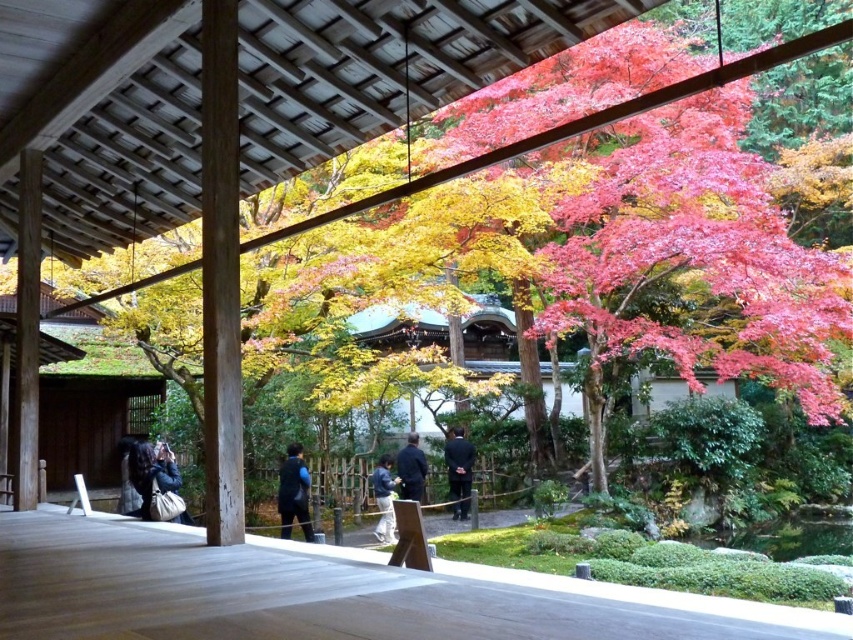
Is black matte vest at center above dark blue fabric at center?

No.

Which is in front, point (289, 456) or point (445, 461)?

Point (289, 456) is in front.

Find the location of a particular element. black matte vest at center is located at coordinates (294, 492).

Is dark blue fabric bag at lower left further to the viewer compared to black matte vest at center?

That is False.

This screenshot has width=853, height=640. What do you see at coordinates (155, 483) in the screenshot?
I see `dark blue fabric bag at lower left` at bounding box center [155, 483].

Describe the element at coordinates (155, 483) in the screenshot. Image resolution: width=853 pixels, height=640 pixels. I see `dark blue fabric bag at lower left` at that location.

Identify the location of dark blue fabric bag at lower left. This screenshot has height=640, width=853. (155, 483).

Does dark blue fabric bag at lower left have a smaller size compared to dark blue fabric jacket at center?

Incorrect, dark blue fabric bag at lower left is not smaller in size than dark blue fabric jacket at center.

Is dark blue fabric bag at lower left shorter than dark blue fabric jacket at center?

Indeed, dark blue fabric bag at lower left has a lesser height compared to dark blue fabric jacket at center.

Is point (177, 493) positioned before point (404, 477)?

Yes, it is.

Locate an element on the screen. The height and width of the screenshot is (640, 853). dark blue fabric bag at lower left is located at coordinates pos(155,483).